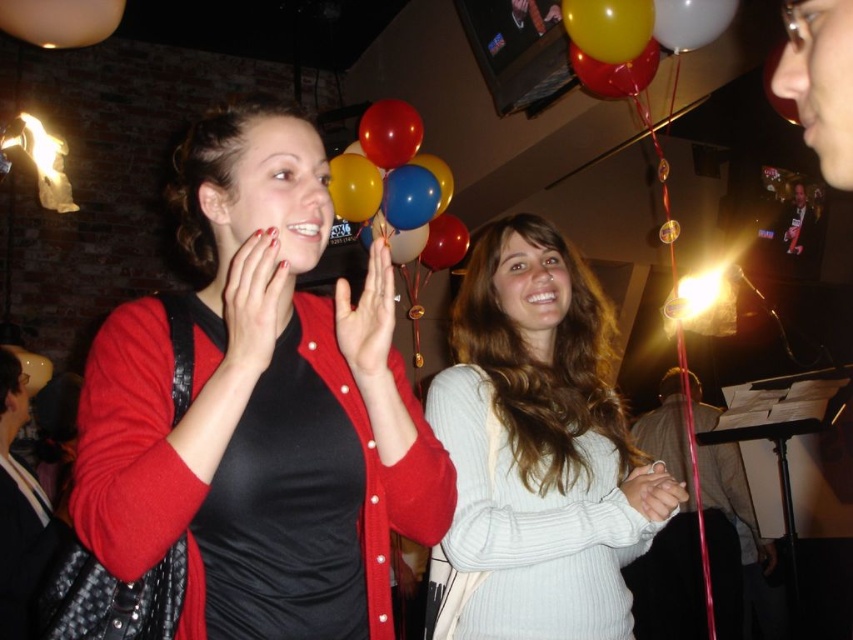
Question: Considering the relative positions of white glossy balloon at upper center and matte yellow balloon at upper center in the image provided, where is white glossy balloon at upper center located with respect to matte yellow balloon at upper center?

Choices:
 (A) below
 (B) above

Answer: (B)

Question: Which object appears closest to the camera in this image?

Choices:
 (A) yellow matte balloon at upper center
 (B) matte yellow balloon at upper center
 (C) white glossy balloon at upper center

Answer: (A)

Question: Which object appears closest to the camera in this image?

Choices:
 (A) rubber balloons at center
 (B) shiny metallic balloons at upper center
 (C) matte black sweater at center

Answer: (C)

Question: Estimate the real-world distances between objects in this image. Which object is closer to the matte yellow balloon at upper center?

Choices:
 (A) matte black sweater at center
 (B) shiny metallic balloons at upper center
 (C) white glossy balloon at upper center
 (D) yellow matte balloon at upper center

Answer: (D)

Question: Where is rubber balloons at center located in relation to matte yellow balloon at upper center in the image?

Choices:
 (A) above
 (B) below

Answer: (B)

Question: Is rubber balloons at center wider than white glossy balloon at upper center?

Choices:
 (A) no
 (B) yes

Answer: (B)